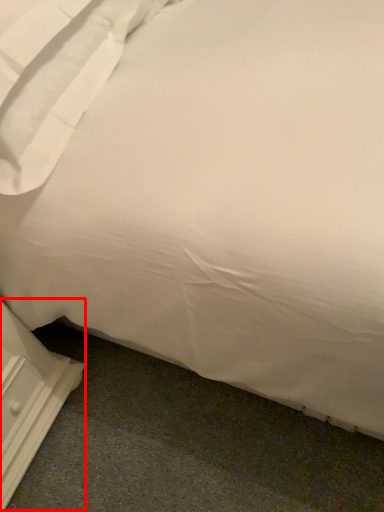
Question: From the image, what is the correct spatial relationship of dresser (annotated by the red box) in relation to pillow?

Choices:
 (A) left
 (B) right

Answer: (A)